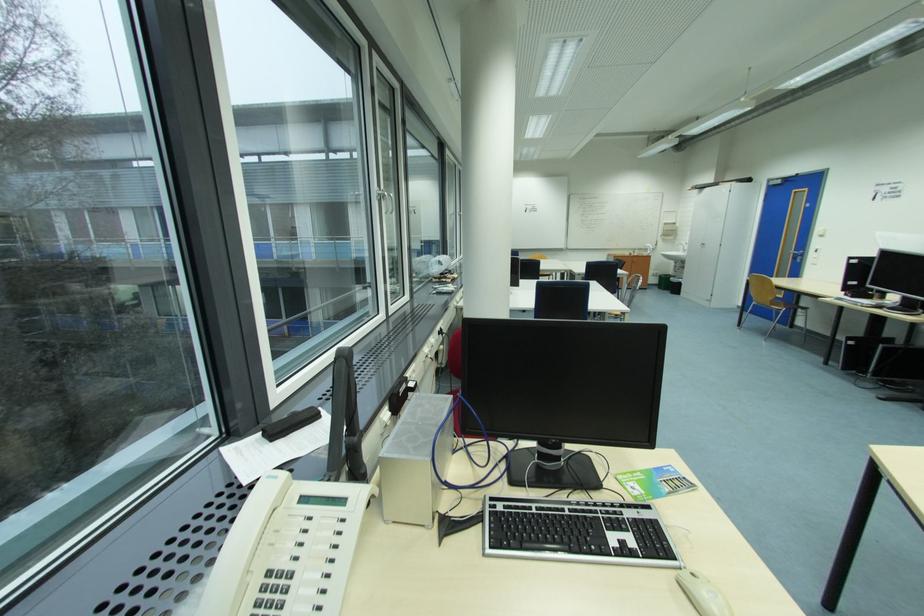
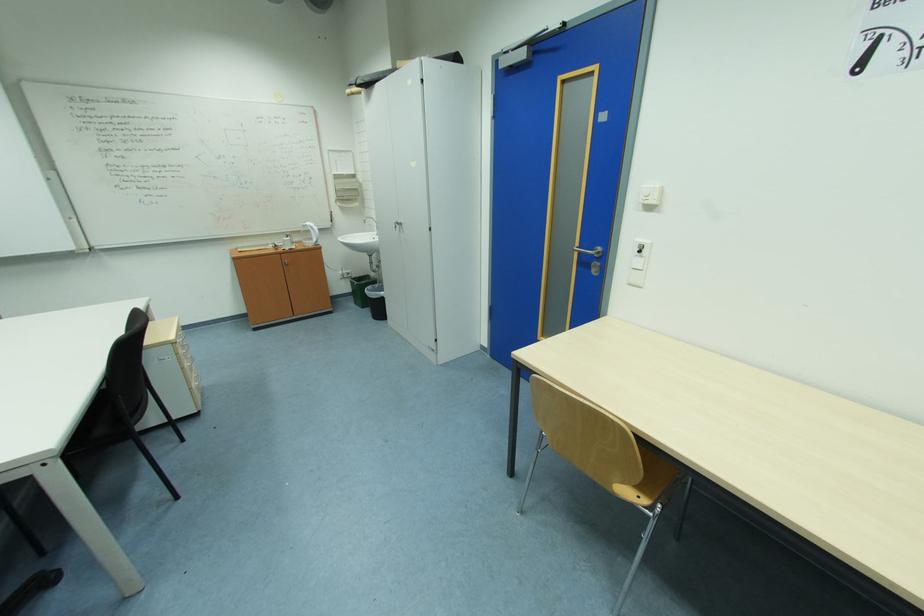
Locate, in the second image, the point that corresponds to point 671,291 in the first image.

(370, 309)